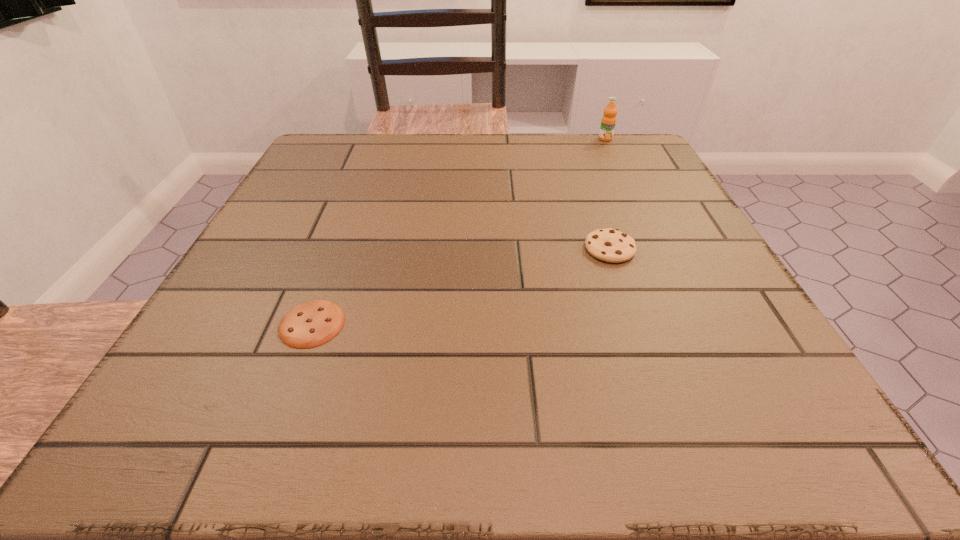
Find the location of `blank region between the orange juice and the second tallest object`. blank region between the orange juice and the second tallest object is located at coordinates (608, 194).

Image resolution: width=960 pixels, height=540 pixels. Find the location of `object that is the closest one to the right cookie`. object that is the closest one to the right cookie is located at coordinates (608, 122).

The image size is (960, 540). I want to click on object that is the second closest to the second farthest object, so click(310, 324).

Where is `blank space that satisfies the following two spatial constraints: 1. on the back side of the nearer cookie; 2. on the right side of the second farthest object`? blank space that satisfies the following two spatial constraints: 1. on the back side of the nearer cookie; 2. on the right side of the second farthest object is located at coordinates (340, 249).

Where is `vacant region that satisfies the following two spatial constraints: 1. on the back side of the second object from left to right; 2. on the left side of the shorter cookie`? This screenshot has height=540, width=960. vacant region that satisfies the following two spatial constraints: 1. on the back side of the second object from left to right; 2. on the left side of the shorter cookie is located at coordinates (340, 249).